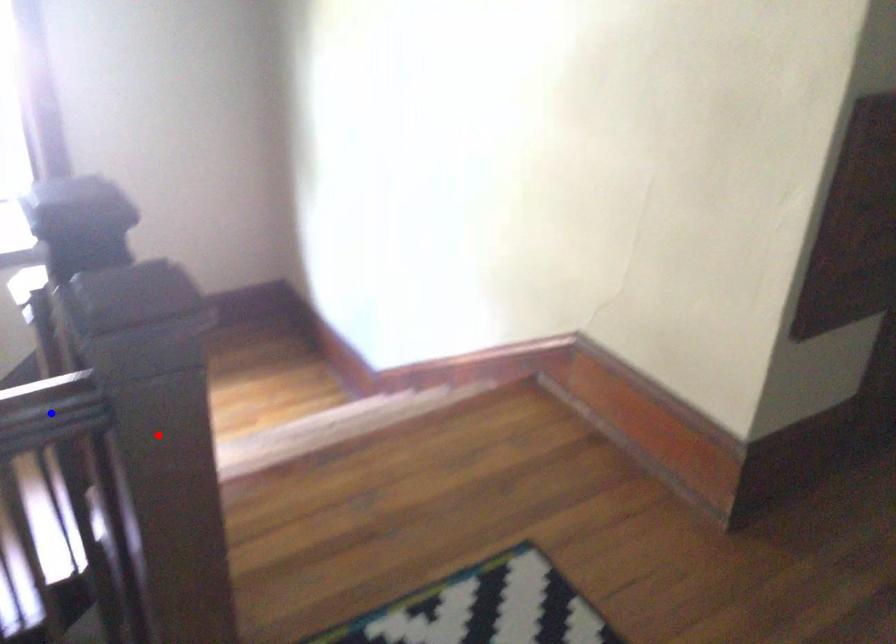
Question: Which of the two points in the image is closer to the camera?

Choices:
 (A) Blue point is closer.
 (B) Red point is closer.

Answer: (A)